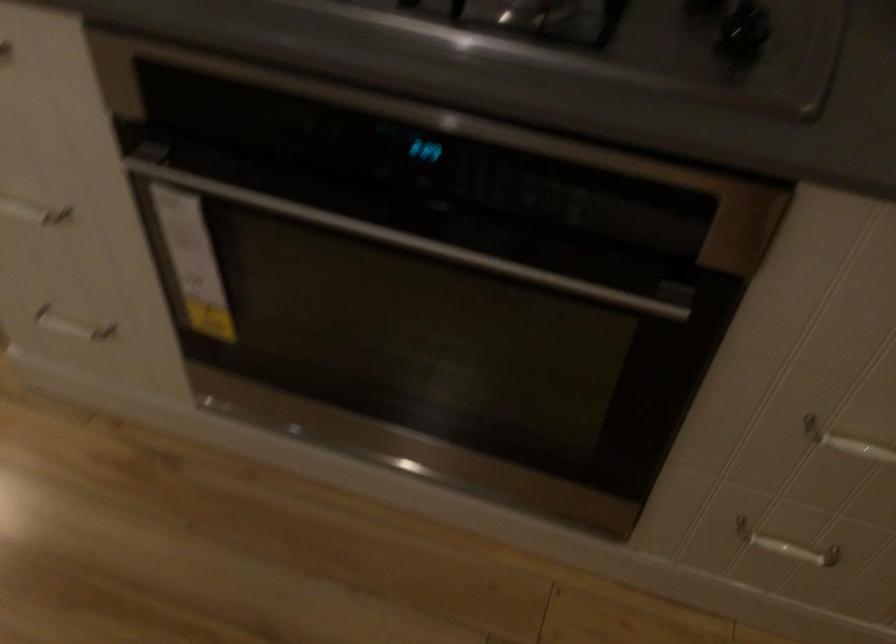
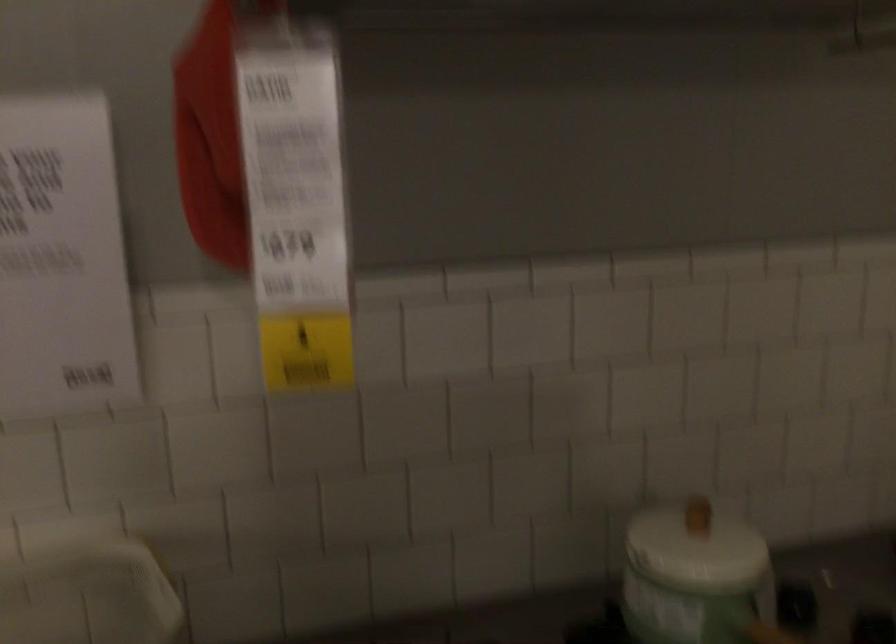
Based on the continuous images, in which direction is the camera rotating?

The camera's rotation is toward right-up.